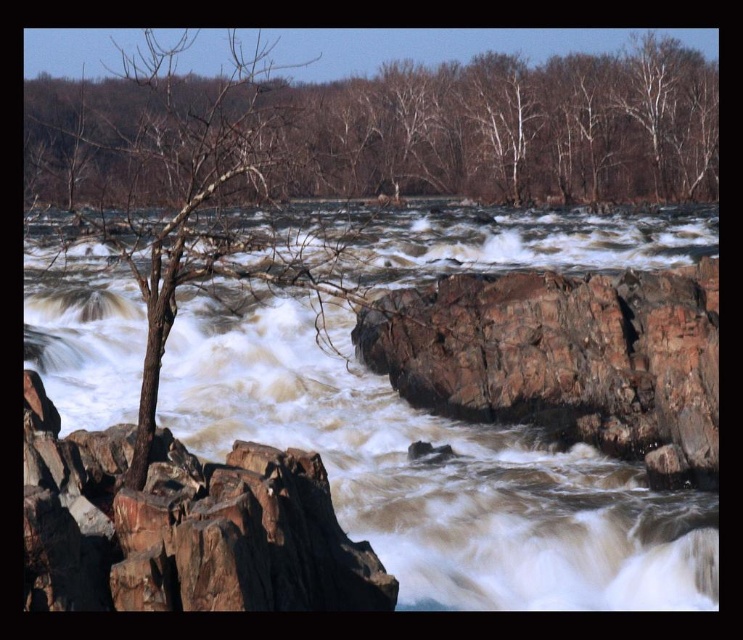
How much distance is there between brown rocky stream at center and rusty rock at center?

19.53 feet

Is point (292, 228) positioned before point (551, 387)?

That is True.

Locate an element on the screen. brown rocky stream at center is located at coordinates (434, 472).

In the scene shown: Is brown rough rock at left below rusty rock at center?

Yes.

Does point (305, 493) come closer to viewer compared to point (596, 342)?

Yes.

Where is `brown rough rock at left`? brown rough rock at left is located at coordinates (181, 525).

Describe the element at coordinates (506, 128) in the screenshot. Image resolution: width=743 pixels, height=640 pixels. I see `bare branches at upper center` at that location.

What are the coordinates of `bare branches at upper center` in the screenshot? It's located at (506, 128).

Image resolution: width=743 pixels, height=640 pixels. In order to click on bare branches at upper center in this screenshot , I will do `click(506, 128)`.